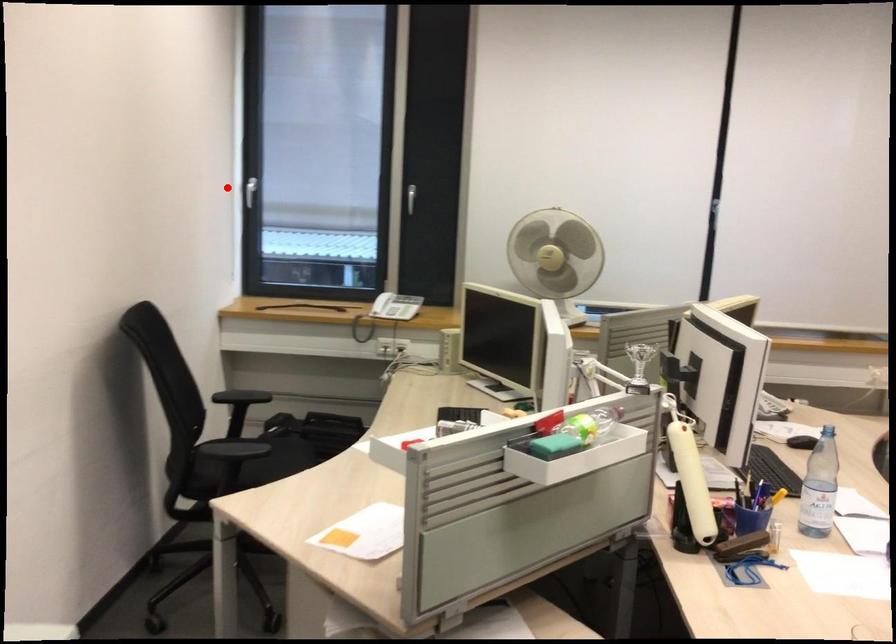
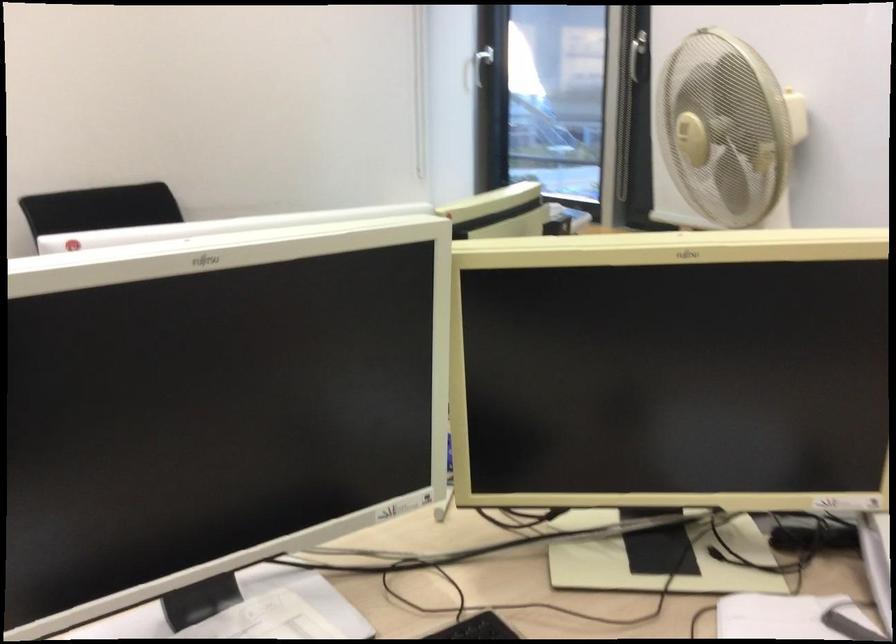
Where in the second image is the point corresponding to the highlighted location from the first image?

(476, 69)